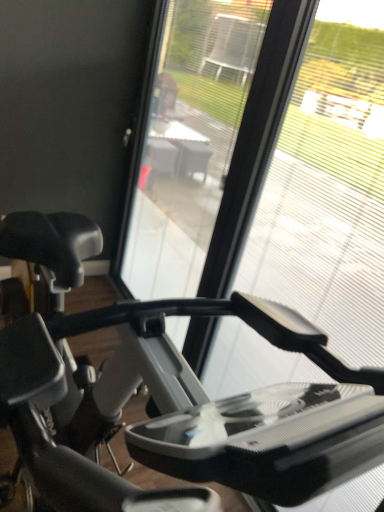
Question: From the image's perspective, is matte black stationary bicycle at left on transparent plastic glass at center?

Choices:
 (A) yes
 (B) no

Answer: (B)

Question: Is matte black stationary bicycle at left thinner than transparent plastic glass at center?

Choices:
 (A) no
 (B) yes

Answer: (A)

Question: Is matte black stationary bicycle at left positioned beyond the bounds of transparent plastic glass at center?

Choices:
 (A) yes
 (B) no

Answer: (A)

Question: Is matte black stationary bicycle at left looking in the opposite direction of transparent plastic glass at center?

Choices:
 (A) no
 (B) yes

Answer: (B)

Question: Can you confirm if matte black stationary bicycle at left is bigger than transparent plastic glass at center?

Choices:
 (A) no
 (B) yes

Answer: (B)

Question: Considering the positions of transparent plastic glass at center and transparent plastic screen door at center in the image, is transparent plastic glass at center bigger or smaller than transparent plastic screen door at center?

Choices:
 (A) big
 (B) small

Answer: (B)

Question: From a real-world perspective, relative to transparent plastic screen door at center, is transparent plastic glass at center vertically above or below?

Choices:
 (A) above
 (B) below

Answer: (A)

Question: Looking at their shapes, would you say transparent plastic glass at center is wider or thinner than transparent plastic screen door at center?

Choices:
 (A) wide
 (B) thin

Answer: (B)

Question: In the image, is transparent plastic glass at center on the left side or the right side of transparent plastic screen door at center?

Choices:
 (A) right
 (B) left

Answer: (A)

Question: Would you say matte black stationary bicycle at left is inside or outside transparent plastic screen door at center?

Choices:
 (A) outside
 (B) inside

Answer: (A)

Question: Based on their positions, is matte black stationary bicycle at left located to the left or right of transparent plastic screen door at center?

Choices:
 (A) left
 (B) right

Answer: (A)

Question: Is matte black stationary bicycle at left in front of or behind transparent plastic screen door at center in the image?

Choices:
 (A) front
 (B) behind

Answer: (A)

Question: From a real-world perspective, is matte black stationary bicycle at left above or below transparent plastic screen door at center?

Choices:
 (A) above
 (B) below

Answer: (B)

Question: From the image's perspective, is matte black stationary bicycle at left positioned above or below transparent plastic glass at center?

Choices:
 (A) above
 (B) below

Answer: (B)

Question: In the image, is matte black stationary bicycle at left positioned in front of or behind transparent plastic glass at center?

Choices:
 (A) front
 (B) behind

Answer: (A)